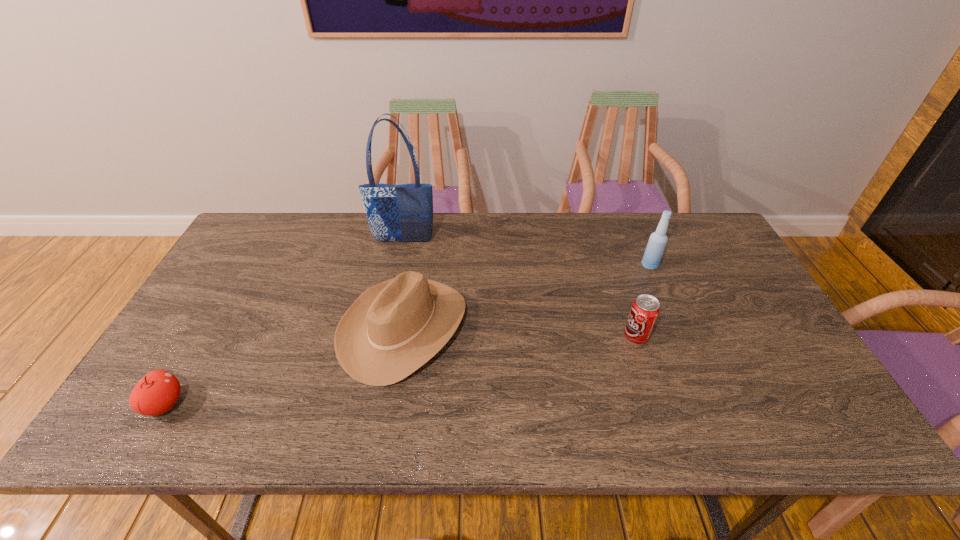
The width and height of the screenshot is (960, 540). In order to click on the farthest object in this screenshot , I will do `click(396, 213)`.

You are a GUI agent. You are given a task and a screenshot of the screen. Output one action in this format:
    pyautogui.click(x=<x>, y=<y>)
    Task: Click on the shopping bag
    
    Given the screenshot: What is the action you would take?
    pyautogui.click(x=396, y=213)

This screenshot has height=540, width=960. I want to click on bottle, so click(x=654, y=251).

Where is `the second tallest object`? Image resolution: width=960 pixels, height=540 pixels. the second tallest object is located at coordinates (654, 251).

The image size is (960, 540). What are the coordinates of `cowboy hat` in the screenshot? It's located at (393, 328).

Locate an element on the screen. This screenshot has height=540, width=960. soda is located at coordinates (645, 310).

The image size is (960, 540). What are the coordinates of `the shortest object` in the screenshot? It's located at (157, 392).

The height and width of the screenshot is (540, 960). I want to click on the leftmost object, so click(157, 392).

Locate an element on the screen. Image resolution: width=960 pixels, height=540 pixels. free location located on the front-facing side of the shopping bag is located at coordinates (393, 296).

Locate an element on the screen. This screenshot has width=960, height=540. vacant area located 0.240m on the front of the fourth shortest object is located at coordinates (678, 332).